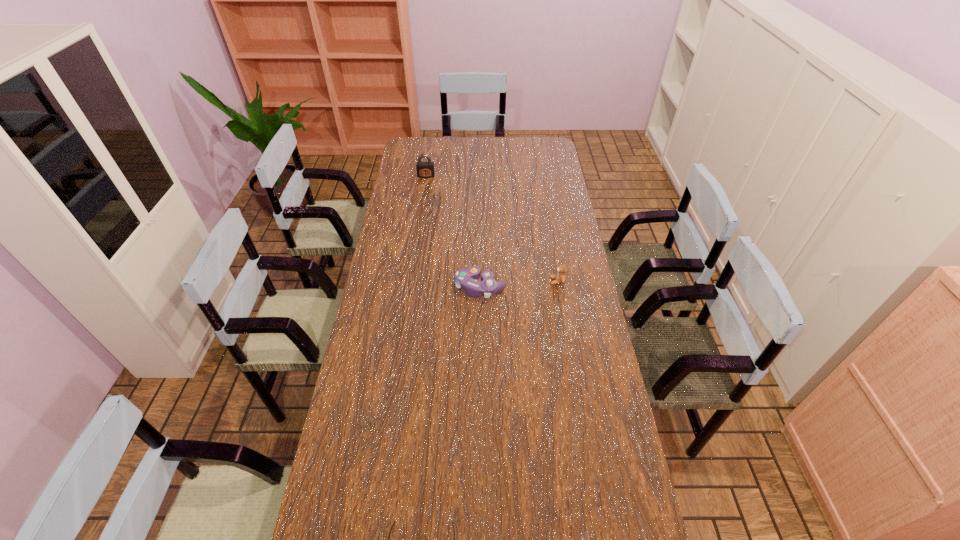
Locate an element on the screen. The height and width of the screenshot is (540, 960). the farthest object is located at coordinates (424, 169).

Where is `the tallest object`? the tallest object is located at coordinates (424, 169).

Find the location of a particular element. the rightmost object is located at coordinates tap(560, 278).

You are a GUI agent. You are given a task and a screenshot of the screen. Output one action in this format:
    pyautogui.click(x=<x>, y=<y>)
    Task: Click on the control
    
    Given the screenshot: What is the action you would take?
    pyautogui.click(x=465, y=278)

Where is `vacant space located 0.270m on the front of the padlock near the keyhole`? The height and width of the screenshot is (540, 960). vacant space located 0.270m on the front of the padlock near the keyhole is located at coordinates (420, 213).

Find the location of a particular element. free space located 0.220m on the front-facing side of the rightmost object is located at coordinates (492, 281).

Where is `free point located 0.240m on the front-facing side of the rightmost object`? This screenshot has height=540, width=960. free point located 0.240m on the front-facing side of the rightmost object is located at coordinates (486, 281).

Image resolution: width=960 pixels, height=540 pixels. What are the coordinates of `free point located on the front-facing side of the rightmost object` in the screenshot? It's located at (462, 281).

The height and width of the screenshot is (540, 960). Identify the location of vacant space located 0.160m on the left of the control. (412, 288).

Find the location of a particular element. Image resolution: width=960 pixels, height=540 pixels. object that is at the left edge is located at coordinates (424, 169).